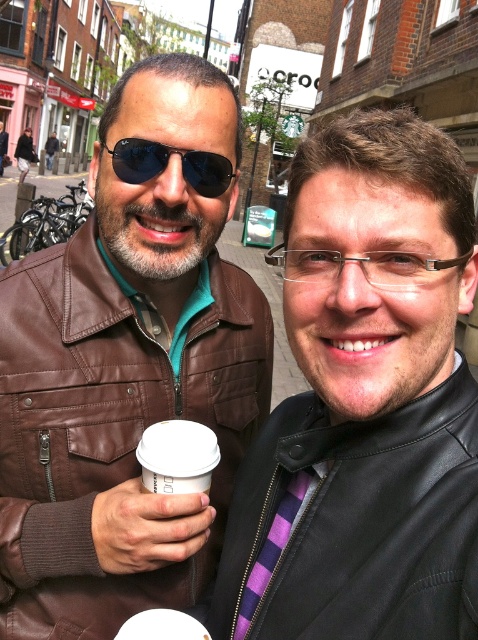
Question: Considering the real-world distances, which object is closest to the matte black sunglasses at upper left?

Choices:
 (A) brown leather jacket at left
 (B) white paper cup at center

Answer: (A)

Question: Among these objects, which one is nearest to the camera?

Choices:
 (A) brown leather jacket at left
 (B) matte black sunglasses at upper left

Answer: (A)

Question: Observing the image, what is the correct spatial positioning of brown leather jacket at left in reference to purple striped tie at center?

Choices:
 (A) above
 (B) below

Answer: (A)

Question: Does brown leather jacket at left appear over white paper cup at center?

Choices:
 (A) no
 (B) yes

Answer: (B)

Question: Where is brown leather jacket at left located in relation to white paper cup at center in the image?

Choices:
 (A) above
 (B) below

Answer: (A)

Question: Which point is closer to the camera?

Choices:
 (A) brown leather jacket at left
 (B) purple striped tie at center
 (C) matte black sunglasses at upper left

Answer: (B)